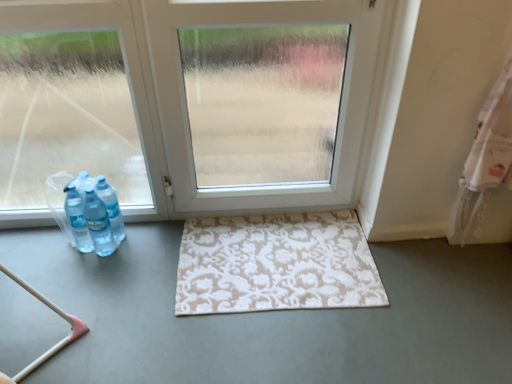
Image resolution: width=512 pixels, height=384 pixels. I want to click on vacant space positioned to the left of translucent plastic bottles at left, so click(42, 247).